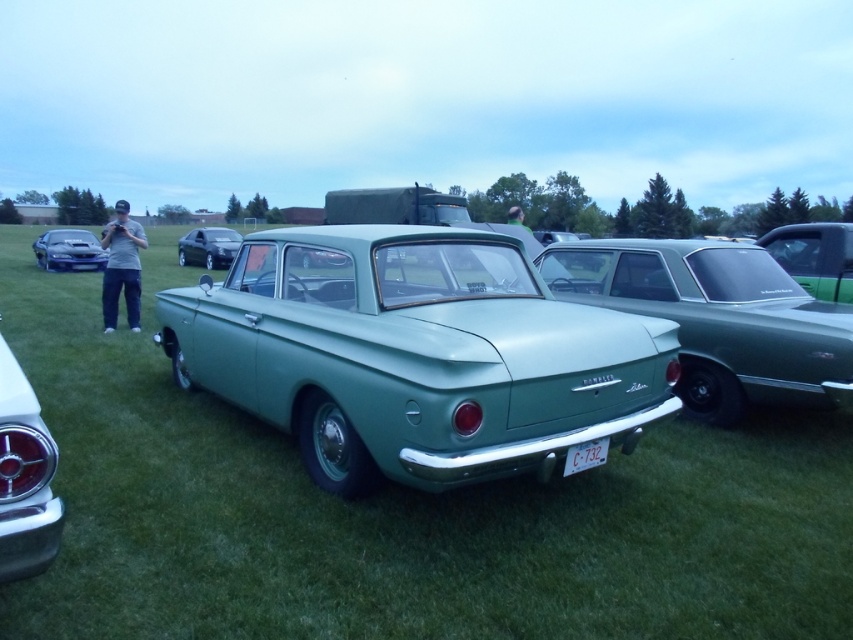
Question: Among these objects, which one is nearest to the camera?

Choices:
 (A) shiny chrome tail light at lower left
 (B) white plastic license plate at center
 (C) satin black car at center

Answer: (A)

Question: Does green matte car at center come behind shiny blue car at left?

Choices:
 (A) no
 (B) yes

Answer: (A)

Question: Which object is positioned closest to the shiny chrome tail light at lower left?

Choices:
 (A) matte green car at center
 (B) shiny blue car at left
 (C) green matte sedan at center
 (D) green matte car at center

Answer: (A)

Question: Which point is farther to the camera?

Choices:
 (A) matte green car at center
 (B) shiny blue car at left
 (C) green matte car at center
 (D) green matte sedan at center

Answer: (B)

Question: Is green matte car at center to the right of white plastic license plate at center from the viewer's perspective?

Choices:
 (A) no
 (B) yes

Answer: (A)

Question: Is matte green car at center to the left of white plastic license plate at center from the viewer's perspective?

Choices:
 (A) yes
 (B) no

Answer: (A)